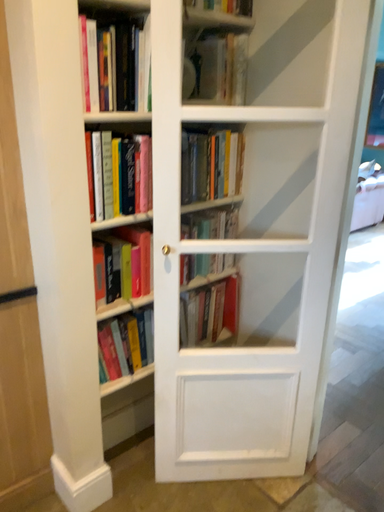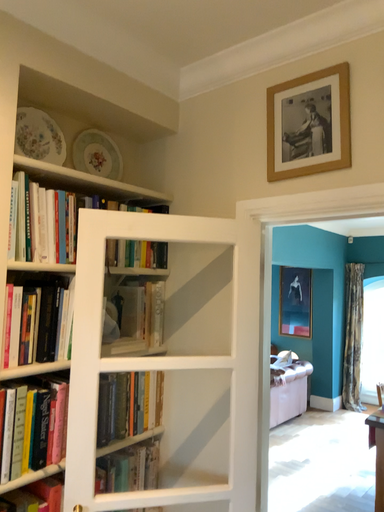
Question: How did the camera likely rotate when shooting the video?

Choices:
 (A) rotated left
 (B) rotated right

Answer: (B)